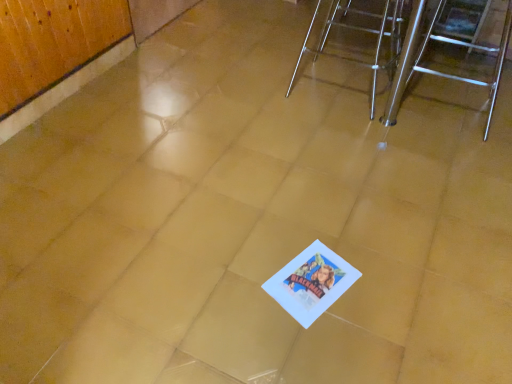
Question: From the image's perspective, is polished stainless steel stool at right, which appears as the 1th furniture when viewed from the right, located above or below metallic silver chair at upper right, acting as the second furniture starting from the right?

Choices:
 (A) below
 (B) above

Answer: (A)

Question: Which is correct: polished stainless steel stool at right, which appears as the 1th furniture when viewed from the right, is inside metallic silver chair at upper right, acting as the second furniture starting from the right, or outside of it?

Choices:
 (A) inside
 (B) outside

Answer: (B)

Question: In terms of size, does polished stainless steel stool at right, the second furniture in the left-to-right sequence, appear bigger or smaller than metallic silver chair at upper right, acting as the second furniture starting from the right?

Choices:
 (A) small
 (B) big

Answer: (B)

Question: From a real-world perspective, is metallic silver chair at upper right, acting as the first furniture starting from the left, positioned above or below polished stainless steel stool at right, which appears as the 1th furniture when viewed from the right?

Choices:
 (A) below
 (B) above

Answer: (A)

Question: Would you say metallic silver chair at upper right, acting as the second furniture starting from the right, is to the left or to the right of polished stainless steel stool at right, which appears as the 1th furniture when viewed from the right, in the picture?

Choices:
 (A) left
 (B) right

Answer: (A)

Question: Is metallic silver chair at upper right, acting as the second furniture starting from the right, inside or outside of polished stainless steel stool at right, which appears as the 1th furniture when viewed from the right?

Choices:
 (A) inside
 (B) outside

Answer: (B)

Question: Considering the positions of metallic silver chair at upper right, acting as the second furniture starting from the right, and polished stainless steel stool at right, the second furniture in the left-to-right sequence, in the image, is metallic silver chair at upper right, acting as the second furniture starting from the right, wider or thinner than polished stainless steel stool at right, the second furniture in the left-to-right sequence,?

Choices:
 (A) wide
 (B) thin

Answer: (B)